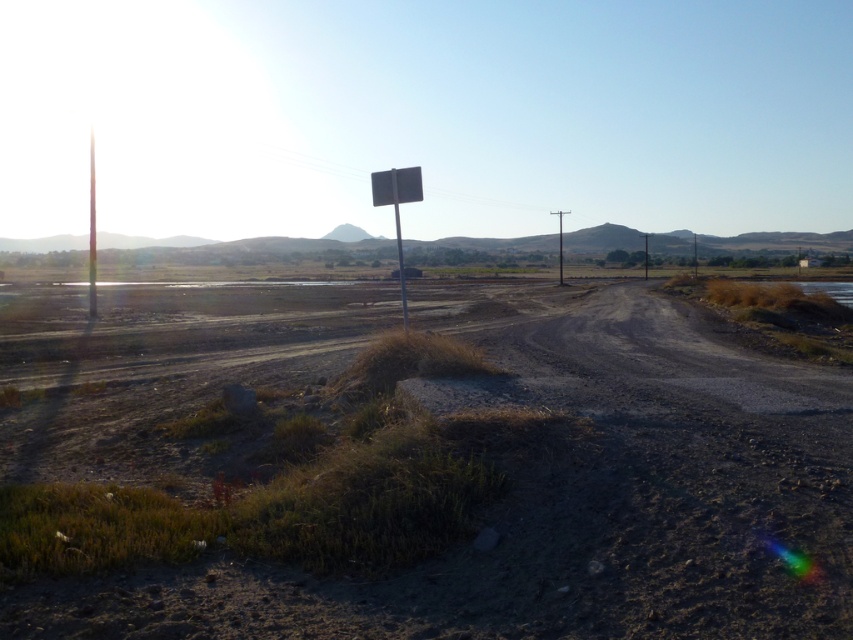
Based on the photo, between metallic sign at center and metallic signpost at center, which one has less height?

metallic sign at center

Can you confirm if metallic sign at center is positioned to the right of metallic signpost at center?

Yes, metallic sign at center is to the right of metallic signpost at center.

Where is `metallic sign at center`? metallic sign at center is located at coordinates 396,186.

What do you see at coordinates (434, 481) in the screenshot? The width and height of the screenshot is (853, 640). I see `dull brown dirt at center` at bounding box center [434, 481].

Who is lower down, dull brown dirt at center or metallic signpost at center?

dull brown dirt at center is below.

The height and width of the screenshot is (640, 853). I want to click on dull brown dirt at center, so click(434, 481).

Can you confirm if metallic gray sign at center is taller than smooth concrete pole at center?

No.

Is point (418, 189) closer to camera compared to point (561, 237)?

Yes, it is.

Find the location of a particular element. This screenshot has width=853, height=640. metallic gray sign at center is located at coordinates (397, 208).